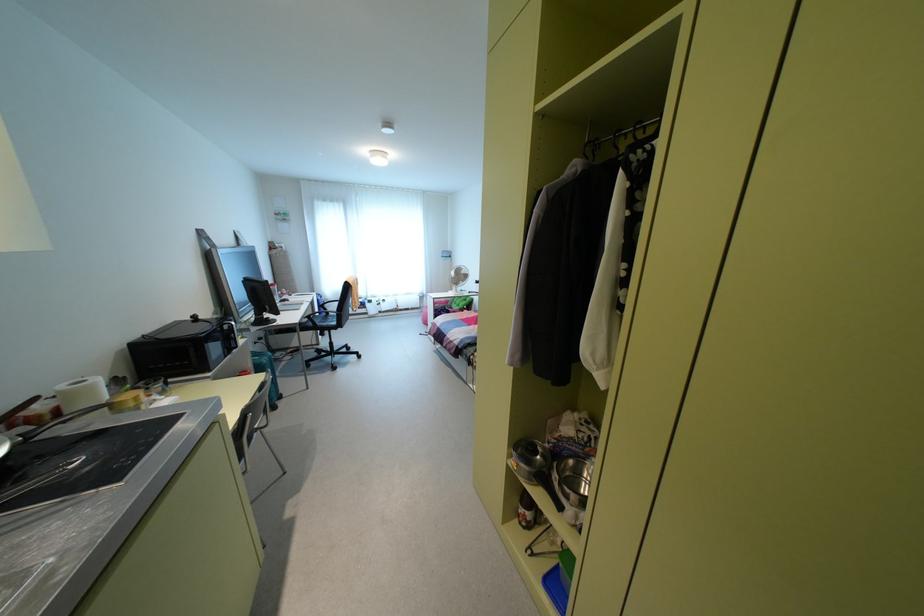
Where would you pull the microwave door handle? Please return your answer as a coordinate pair (x, y).

(227, 338)